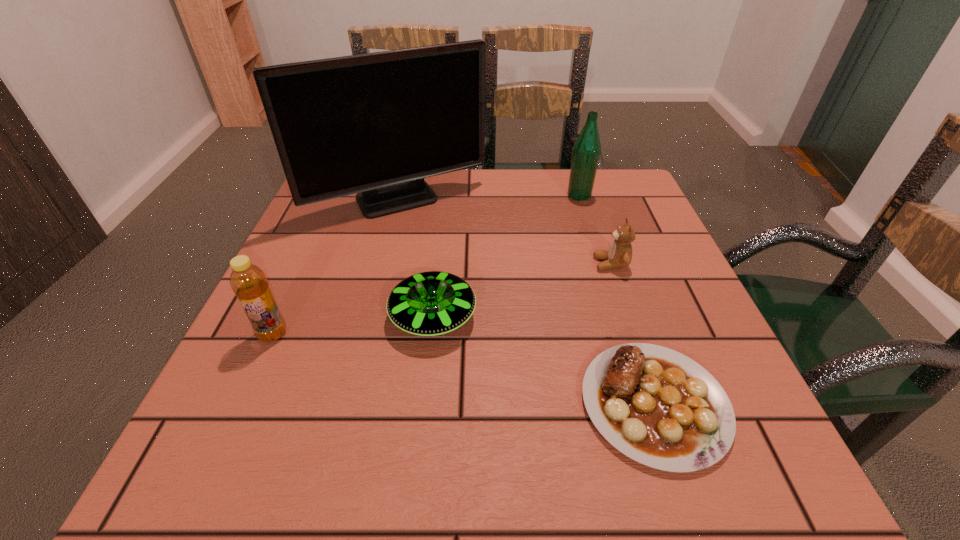
The image size is (960, 540). I want to click on the tallest object, so click(376, 124).

Image resolution: width=960 pixels, height=540 pixels. I want to click on the farther bottle, so click(586, 152).

Locate an element on the screen. The width and height of the screenshot is (960, 540). the taller bottle is located at coordinates (586, 152).

Where is `the left bottle`? the left bottle is located at coordinates (249, 283).

Locate an element on the screen. This screenshot has height=540, width=960. the nearer bottle is located at coordinates (249, 283).

Locate an element on the screen. The height and width of the screenshot is (540, 960). the fourth nearest object is located at coordinates (619, 255).

This screenshot has width=960, height=540. What are the coordinates of `the third shortest object` in the screenshot? It's located at (619, 255).

At what (x,y) coordinates should I click in order to perform the action: click on the fifth tallest object. Please return your answer as a coordinate pair (x, y). Looking at the image, I should click on (433, 303).

This screenshot has height=540, width=960. I want to click on the shortest object, so click(x=660, y=408).

This screenshot has width=960, height=540. Find the location of `blank space located 0.090m on the front-facing side of the computer monitor`. blank space located 0.090m on the front-facing side of the computer monitor is located at coordinates click(386, 252).